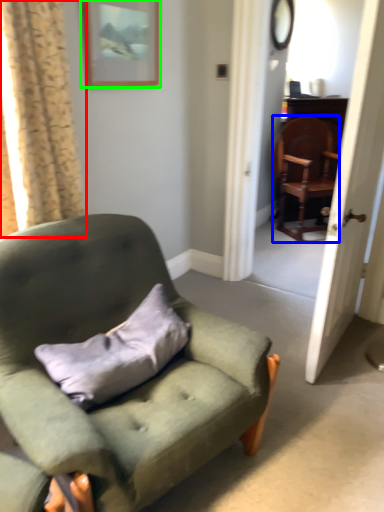
Question: Which is farther away from curtain (highlighted by a red box)? chair (highlighted by a blue box) or picture frame (highlighted by a green box)?

Choices:
 (A) chair
 (B) picture frame

Answer: (A)